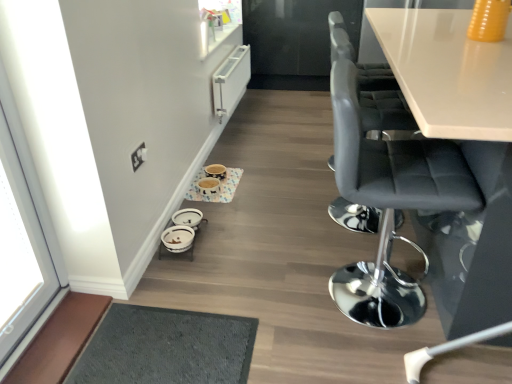
Find the location of `free space in front of gray fabric chair at right, the 2th chair viewed from the front`. free space in front of gray fabric chair at right, the 2th chair viewed from the front is located at coordinates (357, 245).